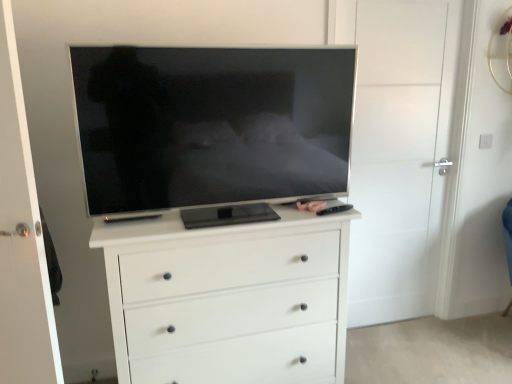
At what (x,y) coordinates should I click in order to perform the action: click on vacant area situated to the left side of matte black remote control at center. Please return your answer as a coordinate pair (x, y). This screenshot has width=512, height=384. Looking at the image, I should click on (280, 214).